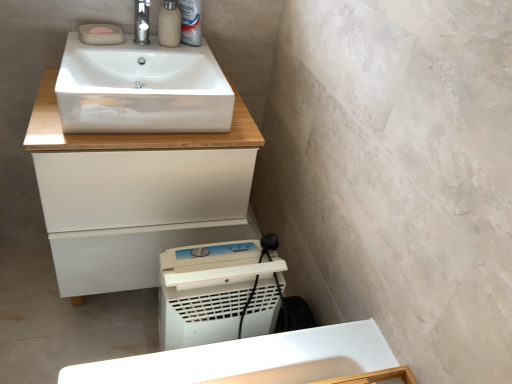
Question: Is white plastic washing machine at lower center taller or shorter than white glossy cabinet at upper center?

Choices:
 (A) tall
 (B) short

Answer: (B)

Question: Considering the positions of point (211, 263) and point (187, 140), is point (211, 263) closer or farther from the camera than point (187, 140)?

Choices:
 (A) closer
 (B) farther

Answer: (A)

Question: Which of these objects is positioned farthest from the white plastic washing machine at lower center?

Choices:
 (A) white plastic can at upper center
 (B) white glossy sink at upper center
 (C) polished chrome tap at upper center
 (D) pink matte soap at upper left
 (E) matte beige soap dispenser at upper center

Answer: (D)

Question: Considering the real-world distances, which object is closest to the white plastic washing machine at lower center?

Choices:
 (A) white plastic can at upper center
 (B) polished chrome tap at upper center
 (C) white glossy cabinet at upper center
 (D) matte beige soap dispenser at upper center
 (E) white glossy sink at upper center

Answer: (C)